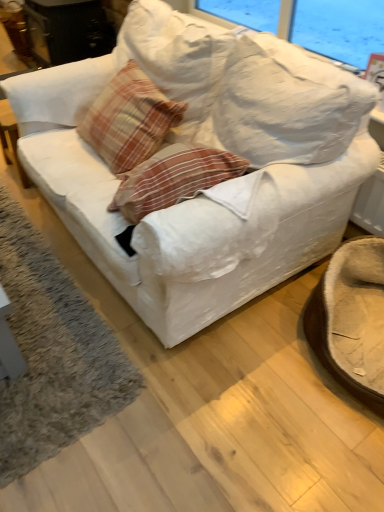
This screenshot has width=384, height=512. What are the coordinates of `free spot to the right of soft gray carpet at lower left` in the screenshot? It's located at (193, 356).